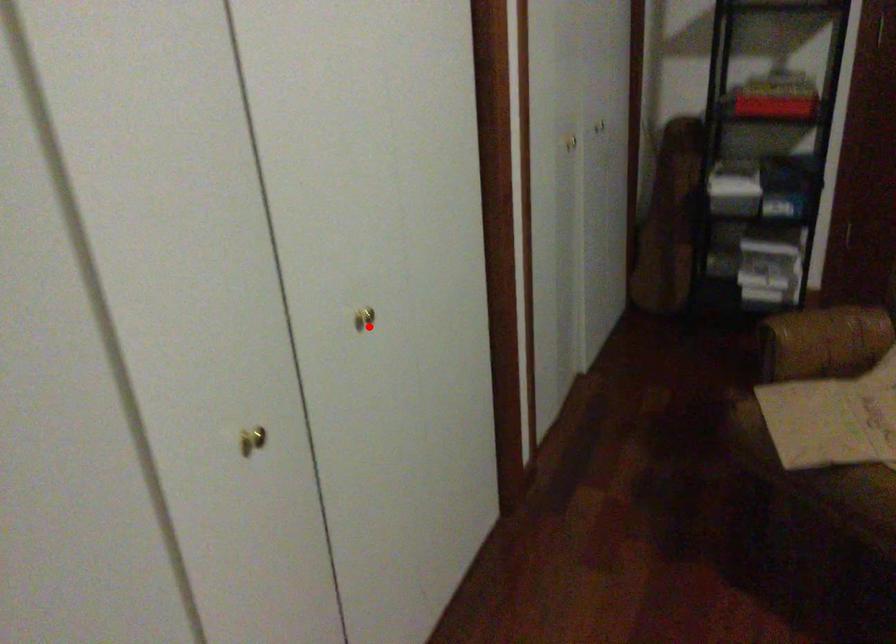
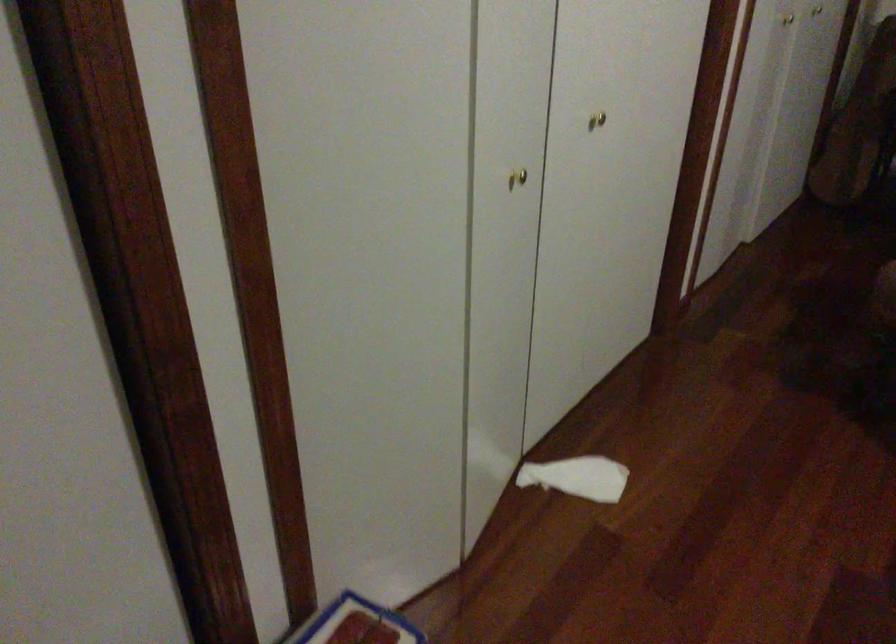
Question: I am providing you with two images of the same scene from different viewpoints. Image1 has a red point marked. In image2, the corresponding 3D location appears at what relative position? Reply with the corresponding letter.

Choices:
 (A) Closer
 (B) Farther

Answer: (B)